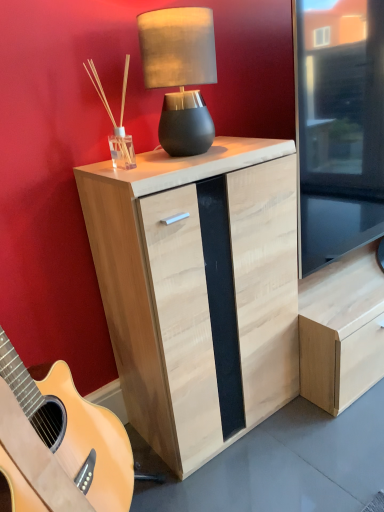
Question: Considering the positions of natural wood cabinet at center and matte black lamp at upper center in the image, is natural wood cabinet at center taller or shorter than matte black lamp at upper center?

Choices:
 (A) tall
 (B) short

Answer: (A)

Question: Is natural wood cabinet at center bigger or smaller than matte black lamp at upper center?

Choices:
 (A) big
 (B) small

Answer: (A)

Question: From the image's perspective, is natural wood cabinet at center located above or below matte black lamp at upper center?

Choices:
 (A) below
 (B) above

Answer: (A)

Question: Relative to natural wood cabinet at center, is matte black lamp at upper center in front or behind?

Choices:
 (A) front
 (B) behind

Answer: (B)

Question: From a real-world perspective, is matte black lamp at upper center above or below natural wood cabinet at center?

Choices:
 (A) above
 (B) below

Answer: (A)

Question: Is matte black lamp at upper center to the left or to the right of natural wood cabinet at center in the image?

Choices:
 (A) right
 (B) left

Answer: (B)

Question: Considering the positions of matte black lamp at upper center and natural wood cabinet at center in the image, is matte black lamp at upper center taller or shorter than natural wood cabinet at center?

Choices:
 (A) tall
 (B) short

Answer: (B)